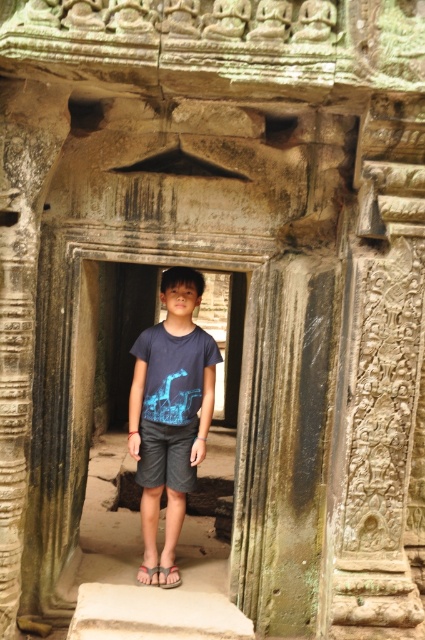
You are a tour guide explaining the ancient temple structure to visitors. You point to the coordinates point (156, 524) and ask them to identify what part of the temple structure this point is pointing to. What should you tell them?

The point (156, 524) corresponds to the smooth stone doorway at center, so you should inform the visitors that this point is pointing to the smooth stone doorway at center.

From the picture: You are a tour guide leading a group through an ancient temple. You notice the smooth stone doorway at center and the dark gray cotton shorts at center. Which object is wider?

The smooth stone doorway at center is wider than the dark gray cotton shorts at center.